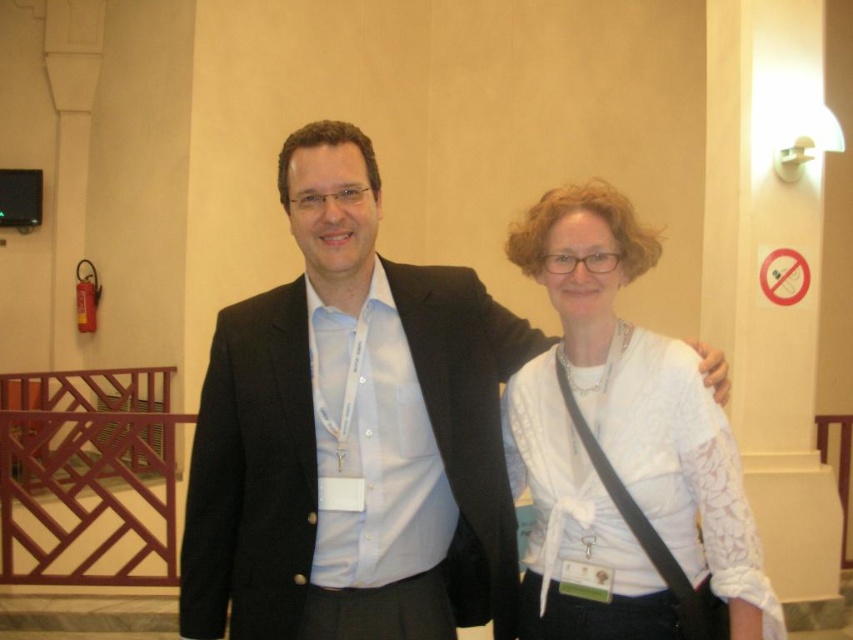
Who is taller, black matte suit at center or white lace shirt at center?

Standing taller between the two is black matte suit at center.

Can you confirm if black matte suit at center is positioned to the right of white lace shirt at center?

Incorrect, black matte suit at center is not on the right side of white lace shirt at center.

You are a GUI agent. You are given a task and a screenshot of the screen. Output one action in this format:
    pyautogui.click(x=<x>, y=<y>)
    Task: Click on the black matte suit at center
    This screenshot has width=853, height=640.
    Given the screenshot: What is the action you would take?
    pyautogui.click(x=352, y=435)